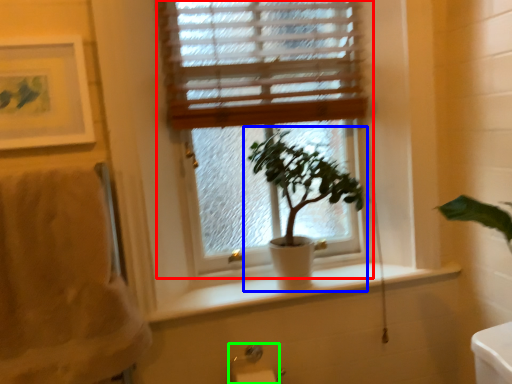
Question: Considering the real-world distances, which object is closest to window (highlighted by a red box)? houseplant (highlighted by a blue box) or towel bar (highlighted by a green box).

Choices:
 (A) houseplant
 (B) towel bar

Answer: (A)